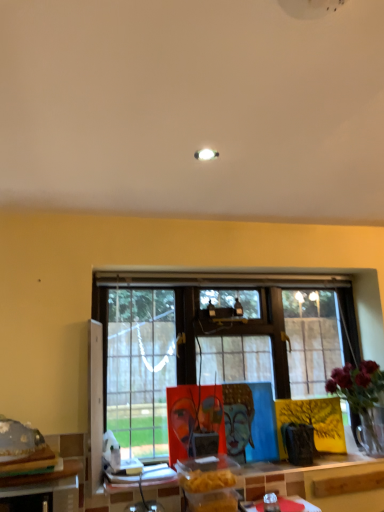
Question: Considering the relative sizes of wooden table at lower left, the 2th table from the right, and wooden table at lower center, acting as the first table starting from the back, in the image provided, is wooden table at lower left, the 2th table from the right, bigger than wooden table at lower center, acting as the first table starting from the back,?

Choices:
 (A) yes
 (B) no

Answer: (A)

Question: From the image's perspective, is wooden table at lower left, which is the 2th table in back-to-front order, under wooden table at lower center, arranged as the 2th table when viewed from the front?

Choices:
 (A) yes
 (B) no

Answer: (B)

Question: From a real-world perspective, is wooden table at lower left, which is the 2th table in back-to-front order, on wooden table at lower center, the 2th table from the left?

Choices:
 (A) yes
 (B) no

Answer: (A)

Question: Is wooden table at lower center, the 1th table positioned from the right, at the back of wooden table at lower left, which is the 1th table from left to right?

Choices:
 (A) no
 (B) yes

Answer: (A)

Question: Can you confirm if wooden table at lower left, the 2th table from the right, is positioned to the right of wooden table at lower center, arranged as the 2th table when viewed from the front?

Choices:
 (A) no
 (B) yes

Answer: (A)

Question: Would you say wooden table at lower left, which is the 2th table in back-to-front order, is to the left or to the right of shiny metallic food at lower left in the picture?

Choices:
 (A) right
 (B) left

Answer: (A)

Question: From the image's perspective, is wooden table at lower left, which is the 1th table from left to right, positioned above or below shiny metallic food at lower left?

Choices:
 (A) above
 (B) below

Answer: (B)

Question: Is wooden table at lower left, which is the 1th table from left to right, in front of or behind shiny metallic food at lower left in the image?

Choices:
 (A) behind
 (B) front

Answer: (B)

Question: Considering the positions of wooden table at lower left, which is the 2th table in back-to-front order, and shiny metallic food at lower left in the image, is wooden table at lower left, which is the 2th table in back-to-front order, taller or shorter than shiny metallic food at lower left?

Choices:
 (A) short
 (B) tall

Answer: (B)

Question: Is green leafy plant at right spatially inside wooden table at lower left, the 2th table from the right, or outside of it?

Choices:
 (A) outside
 (B) inside

Answer: (A)

Question: In terms of height, does green leafy plant at right look taller or shorter compared to wooden table at lower left, the 1th table from the front?

Choices:
 (A) short
 (B) tall

Answer: (B)

Question: Considering the positions of green leafy plant at right and wooden table at lower left, which is the 2th table in back-to-front order, in the image, is green leafy plant at right bigger or smaller than wooden table at lower left, which is the 2th table in back-to-front order,?

Choices:
 (A) small
 (B) big

Answer: (B)

Question: From a real-world perspective, relative to wooden table at lower left, the 2th table from the right, is green leafy plant at right vertically above or below?

Choices:
 (A) below
 (B) above

Answer: (B)

Question: Is point (357, 382) closer or farther from the camera than point (3, 431)?

Choices:
 (A) farther
 (B) closer

Answer: (A)

Question: In terms of height, does green leafy plant at right look taller or shorter compared to shiny metallic food at lower left?

Choices:
 (A) tall
 (B) short

Answer: (A)